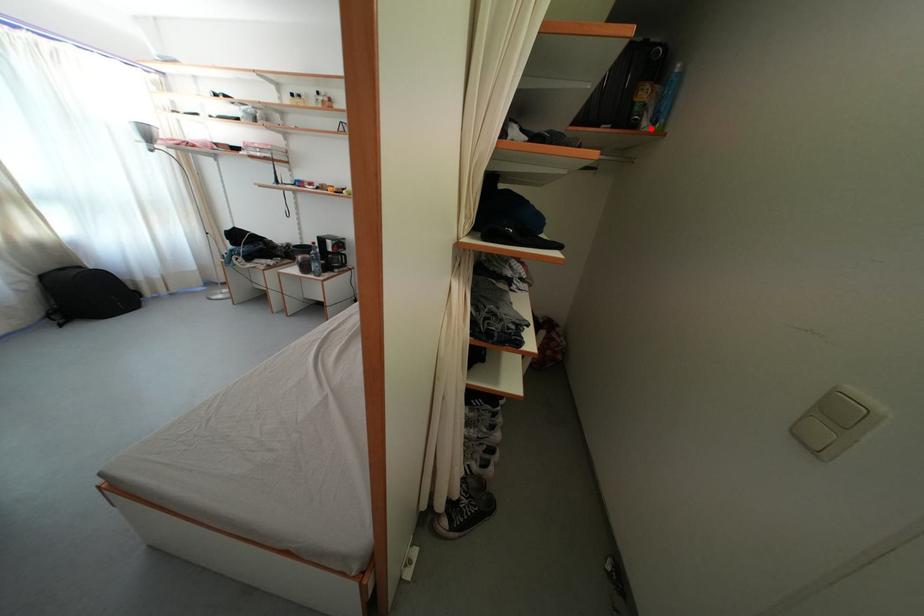
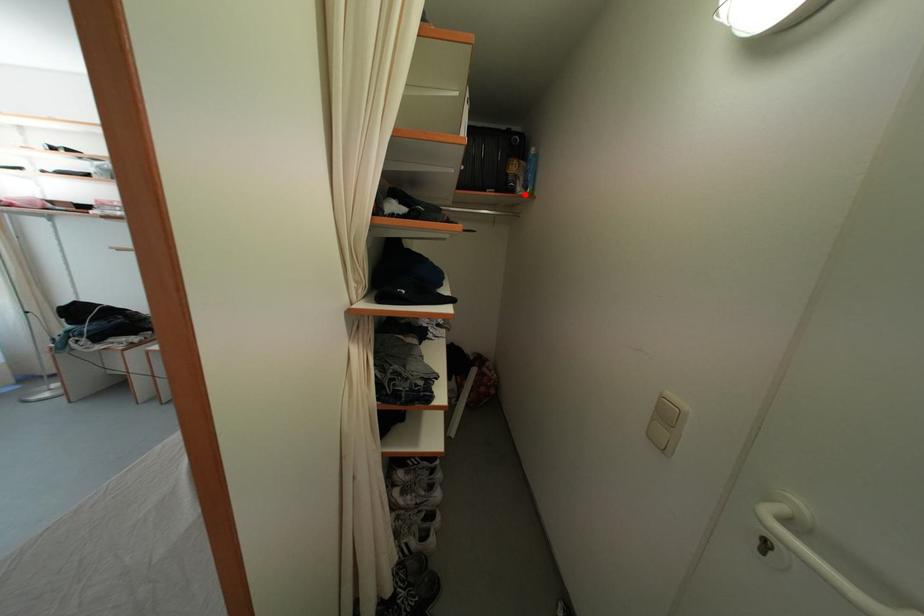
I am providing you with two images of the same scene from different viewpoints. A red point is marked on the first image and another point is marked on the second image. Is the marked point in image1 the same physical position as the marked point in image2?

Yes